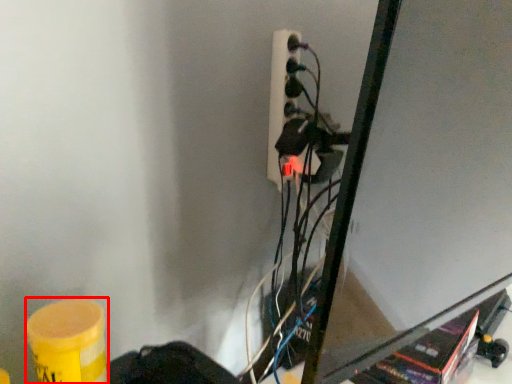
Question: From the image, what is the correct spatial relationship of barrel (annotated by the red box) in relation to power plugs and sockets?

Choices:
 (A) left
 (B) right

Answer: (A)